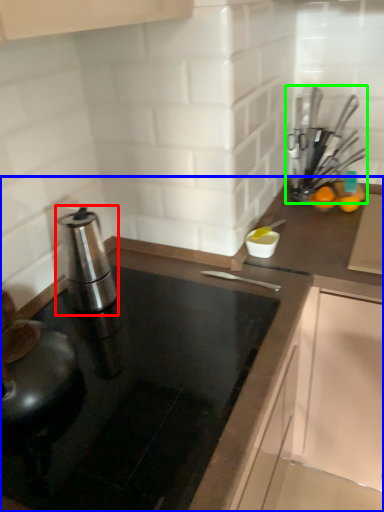
Question: Which is nearer to the kitchen appliance (highlighted by a red box)? countertop (highlighted by a blue box) or kitchen appliance (highlighted by a green box).

Choices:
 (A) countertop
 (B) kitchen appliance

Answer: (A)